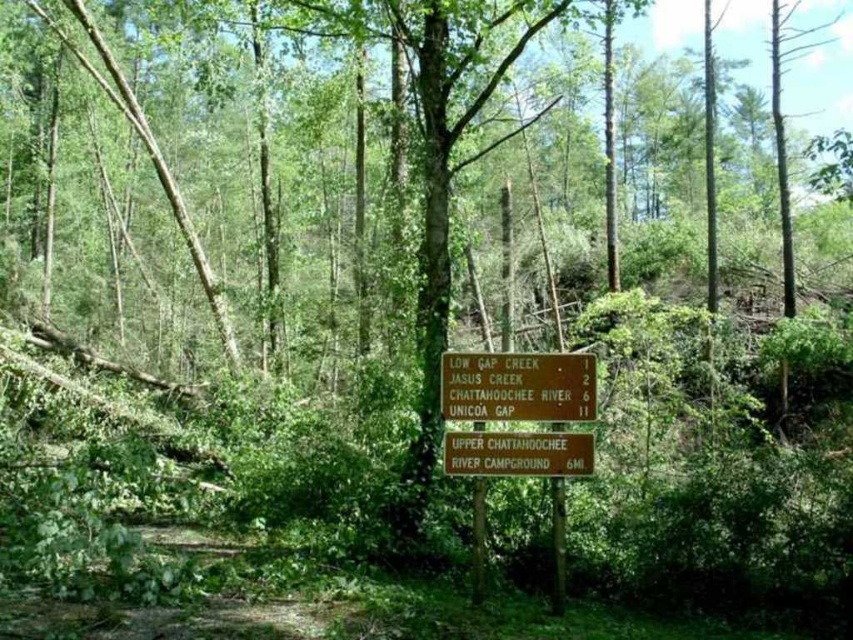
You are a hiker who just arrived at the forest trail. You see a brown wooden sign at center and a green wooden sign at center. Which sign should you read first to get the most immediate information?

The brown wooden sign at center is closer to the viewer than the green wooden sign at center, so you should read the brown wooden sign at center first to get the most immediate information.